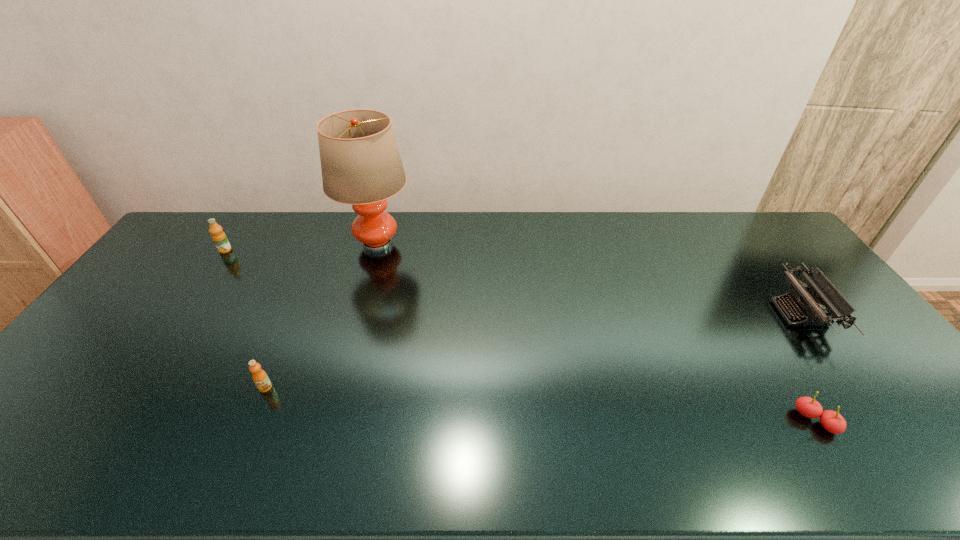
Where is `lamp`? This screenshot has height=540, width=960. lamp is located at coordinates (360, 162).

Where is `the tallest object`? The width and height of the screenshot is (960, 540). the tallest object is located at coordinates (360, 162).

This screenshot has height=540, width=960. I want to click on the taller orange juice, so click(219, 238).

Image resolution: width=960 pixels, height=540 pixels. In order to click on the left orange juice in this screenshot , I will do `click(219, 238)`.

At what (x,y) coordinates should I click in order to perform the action: click on the rightmost object. Please return your answer as a coordinate pair (x, y). Looking at the image, I should click on (823, 294).

Locate an element on the screen. The height and width of the screenshot is (540, 960). the third farthest object is located at coordinates (823, 294).

Where is `the right orange juice`? Image resolution: width=960 pixels, height=540 pixels. the right orange juice is located at coordinates (259, 376).

This screenshot has width=960, height=540. Identify the location of the fourth object from right to left. (259, 376).

Identify the location of cherry. This screenshot has width=960, height=540. (832, 421).

At what (x,y) coordinates should I click in order to perform the action: click on the second object from right to left. Please return your answer as a coordinate pair (x, y). The image size is (960, 540). Looking at the image, I should click on (832, 421).